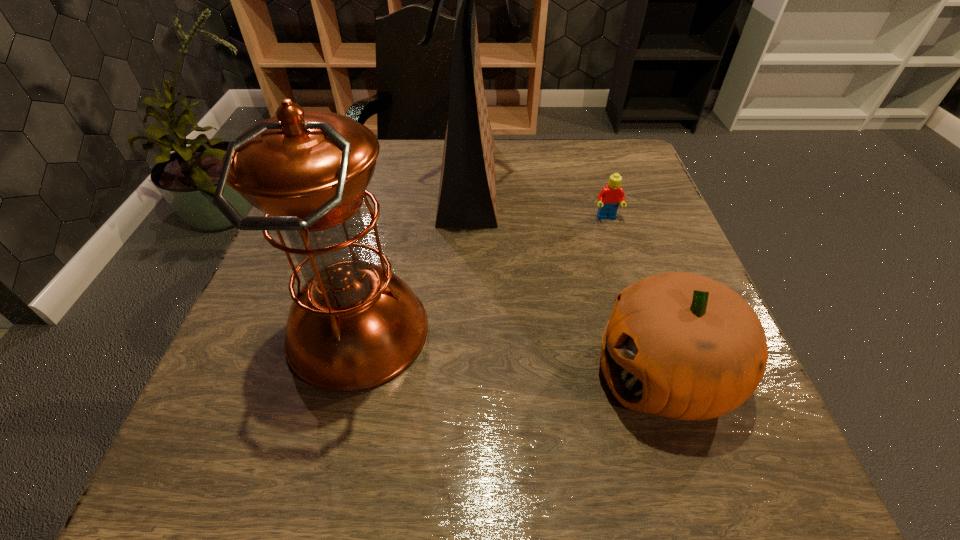
Locate an element on the screen. This screenshot has height=540, width=960. vacant space at the near left corner of the desktop is located at coordinates (188, 495).

Find the location of `vacant space at the far right corner of the desktop`. vacant space at the far right corner of the desktop is located at coordinates (626, 174).

Identify the location of empty space that is in between the oil lamp and the shopping bag. The width and height of the screenshot is (960, 540). (415, 256).

I want to click on vacant area that lies between the shortest object and the shopping bag, so click(540, 199).

Locate an element on the screen. free space between the oil lamp and the pumpkin is located at coordinates (511, 353).

Where is `unoccupied position between the pumpkin and the third shortest object`? Image resolution: width=960 pixels, height=540 pixels. unoccupied position between the pumpkin and the third shortest object is located at coordinates (511, 353).

Find the location of `free space that is in between the oil lamp and the shortest object`. free space that is in between the oil lamp and the shortest object is located at coordinates (482, 275).

Find the location of a particular element. The image size is (960, 540). vacant area that lies between the oil lamp and the Lego is located at coordinates (482, 275).

This screenshot has height=540, width=960. In order to click on vacant area between the shortest object and the oil lamp in this screenshot , I will do `click(482, 275)`.

The image size is (960, 540). What are the coordinates of `object that is the second closest to the oil lamp` in the screenshot? It's located at (680, 345).